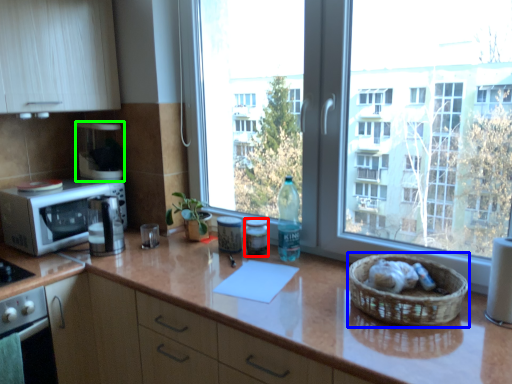
Question: Which object is the closest to the appliance (highlighted by a red box)? Choose among these: basket (highlighted by a blue box) or appliance (highlighted by a green box).

Choices:
 (A) basket
 (B) appliance

Answer: (A)